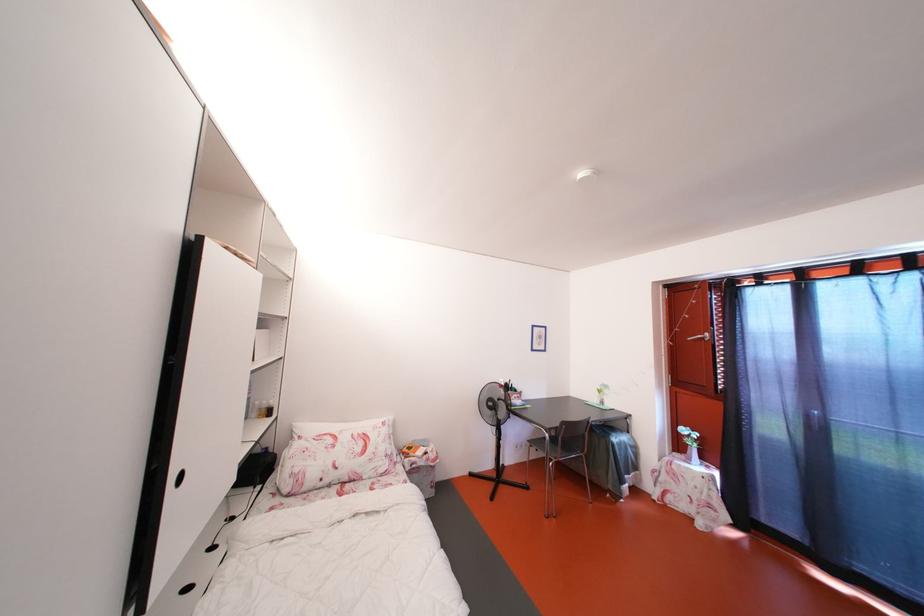
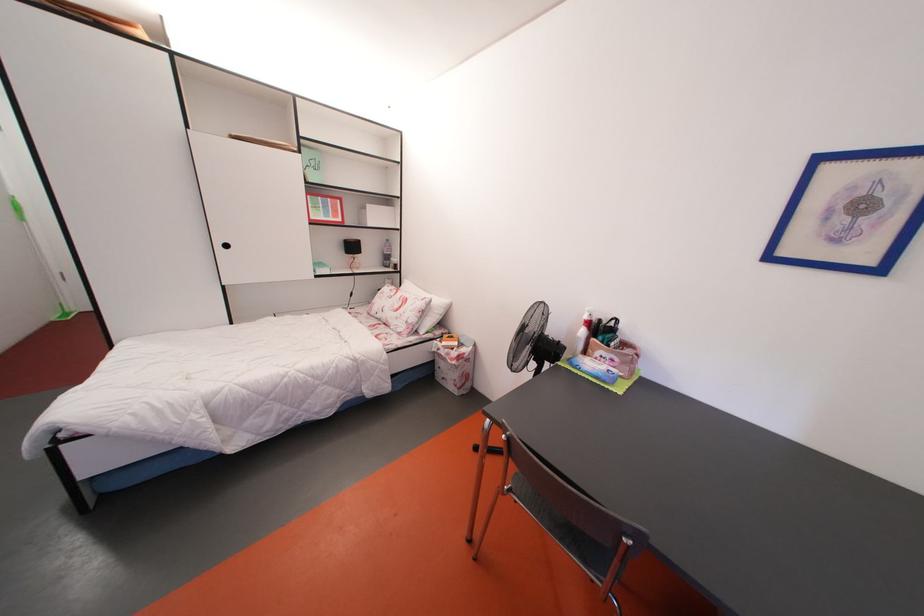
Find the pixel in the second image that matches (x=429, y=469) in the first image.

(450, 360)